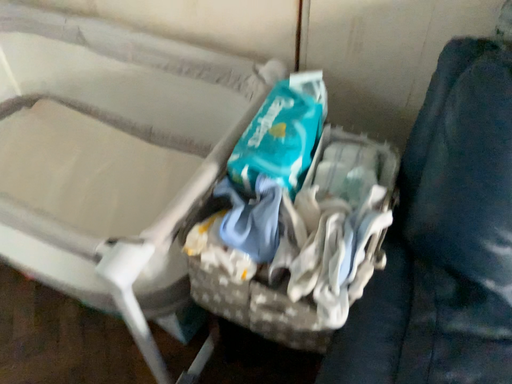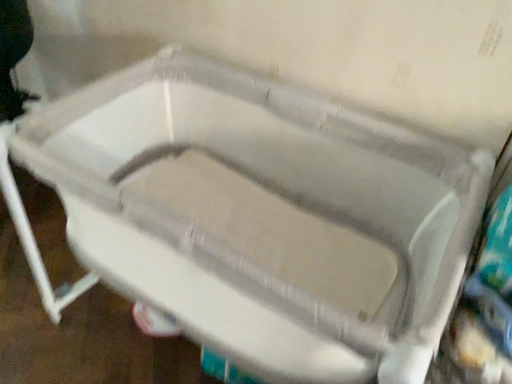
Question: Which way did the camera rotate in the video?

Choices:
 (A) rotated downward
 (B) rotated upward

Answer: (B)